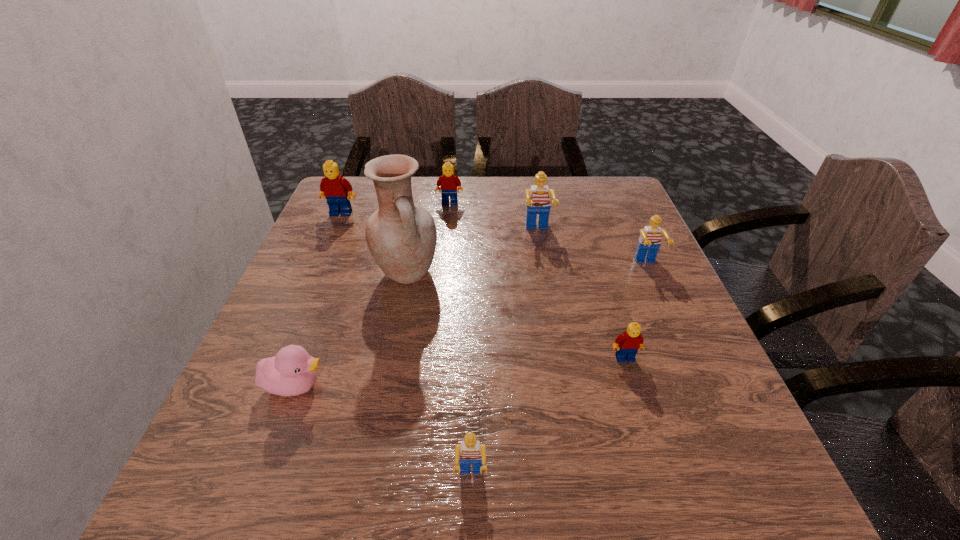
Where is `duckling`? duckling is located at coordinates (292, 371).

This screenshot has width=960, height=540. Find the location of `pink duckling`. pink duckling is located at coordinates pyautogui.click(x=292, y=371).

The image size is (960, 540). Find the location of `the second nearest Lego`. the second nearest Lego is located at coordinates (627, 344).

Locate an element on the screen. the smallest yellow Lego is located at coordinates (627, 344).

Image resolution: width=960 pixels, height=540 pixels. Find the location of `the smallest blue Lego`. the smallest blue Lego is located at coordinates (470, 451).

Where is `the fourth Lego from right to left`? The width and height of the screenshot is (960, 540). the fourth Lego from right to left is located at coordinates (470, 451).

Where is `free location located 0.120m on the front of the pink pottery`? free location located 0.120m on the front of the pink pottery is located at coordinates (x=395, y=340).

Locate an element on the screen. The width and height of the screenshot is (960, 540). free space located 0.310m on the face of the biggest blue Lego is located at coordinates (555, 333).

This screenshot has height=540, width=960. I want to click on vacant space located on the front-facing side of the second farthest Lego, so click(x=334, y=230).

Find the location of `free location located 0.150m on the front-facing side of the farthest object`. free location located 0.150m on the front-facing side of the farthest object is located at coordinates (446, 238).